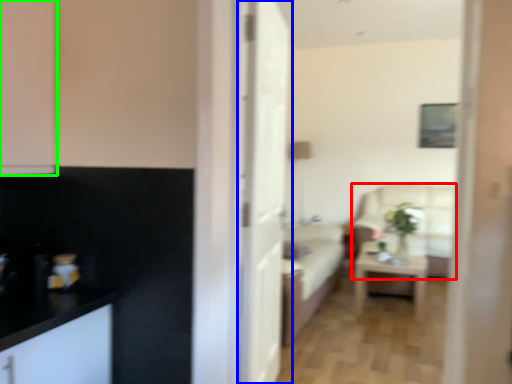
Question: Which is nearer to the armchair (highlighted by a red box)? door (highlighted by a blue box) or cabinetry (highlighted by a green box).

Choices:
 (A) door
 (B) cabinetry

Answer: (A)